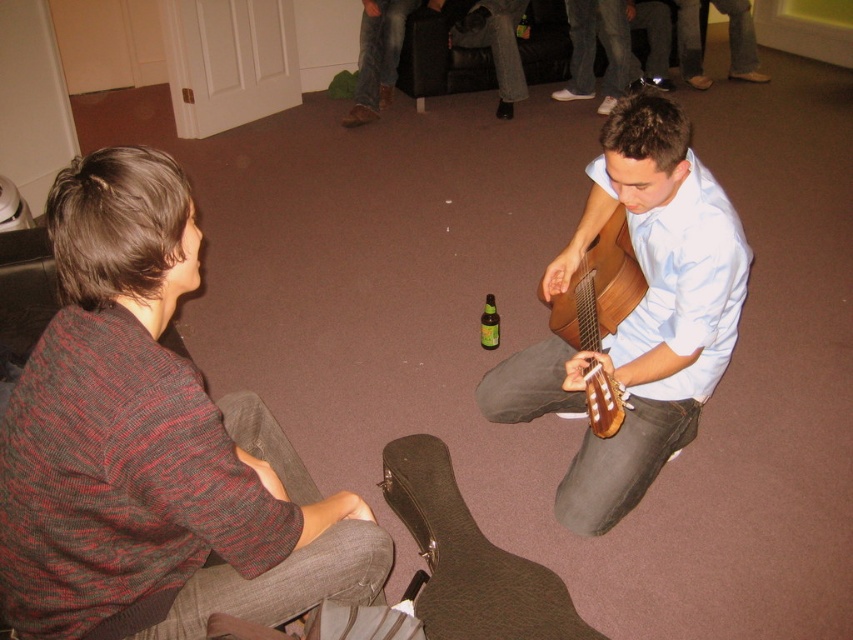
Question: Among these points, which one is nearest to the camera?

Choices:
 (A) (728, 22)
 (B) (488, 348)
 (C) (45, 627)

Answer: (C)

Question: Is light blue shirt at center smaller than green glass bottle at center?

Choices:
 (A) yes
 (B) no

Answer: (B)

Question: Observing the image, what is the correct spatial positioning of knit sweater at left in reference to wooden acoustic guitar at center?

Choices:
 (A) above
 (B) below

Answer: (B)

Question: Which of these objects is positioned closest to the wooden acoustic guitar at center?

Choices:
 (A) knit sweater at left
 (B) light blue shirt at center
 (C) denim jeans at upper right
 (D) wooden guitar at center

Answer: (D)

Question: Where is wooden acoustic guitar at center located in relation to light blue shirt at center in the image?

Choices:
 (A) left
 (B) right

Answer: (A)

Question: Among these objects, which one is nearest to the camera?

Choices:
 (A) knit sweater at left
 (B) denim jeans at upper right
 (C) wooden guitar at center

Answer: (A)